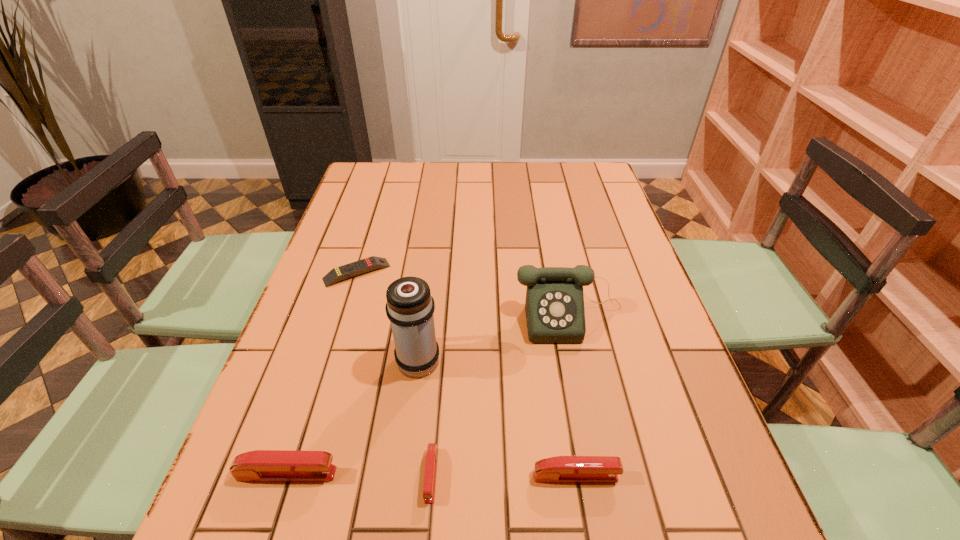
You are a GUI agent. You are given a task and a screenshot of the screen. Output one action in this format:
    pyautogui.click(x=<x>, y=<y>)
    Task: Click on the vacant spot to place a stapler on the right
    The width and height of the screenshot is (960, 540).
    Given the screenshot: What is the action you would take?
    pyautogui.click(x=720, y=477)